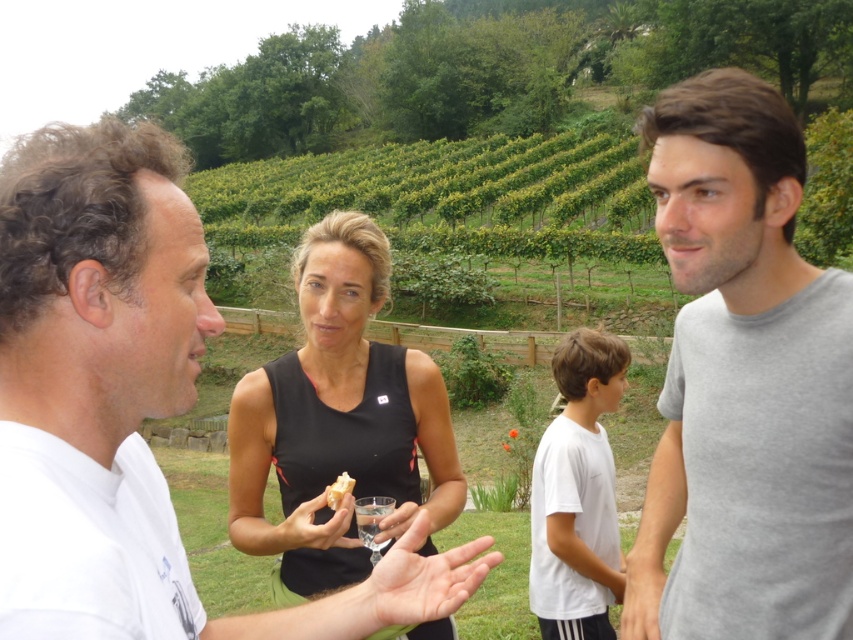
Question: Does gray cotton t-shirt at right come in front of white cotton shirt at center?

Choices:
 (A) no
 (B) yes

Answer: (B)

Question: Based on their relative distances, which object is nearer to the gray cotton t-shirt at right?

Choices:
 (A) black matte tank top at center
 (B) white cotton shirt at upper left
 (C) white cotton shirt at center

Answer: (C)

Question: Which point is farther to the camera?

Choices:
 (A) (552, 563)
 (B) (344, 490)
 (C) (231, 472)
 (D) (73, 323)

Answer: (A)

Question: Which is farther from the black matte tank top at center?

Choices:
 (A) white cotton shirt at center
 (B) white crumbly bread at center

Answer: (A)

Question: Can you confirm if gray cotton t-shirt at right is wider than white cotton shirt at center?

Choices:
 (A) no
 (B) yes

Answer: (B)

Question: From the image, what is the correct spatial relationship of black matte tank top at center in relation to white cotton shirt at center?

Choices:
 (A) left
 (B) right

Answer: (A)